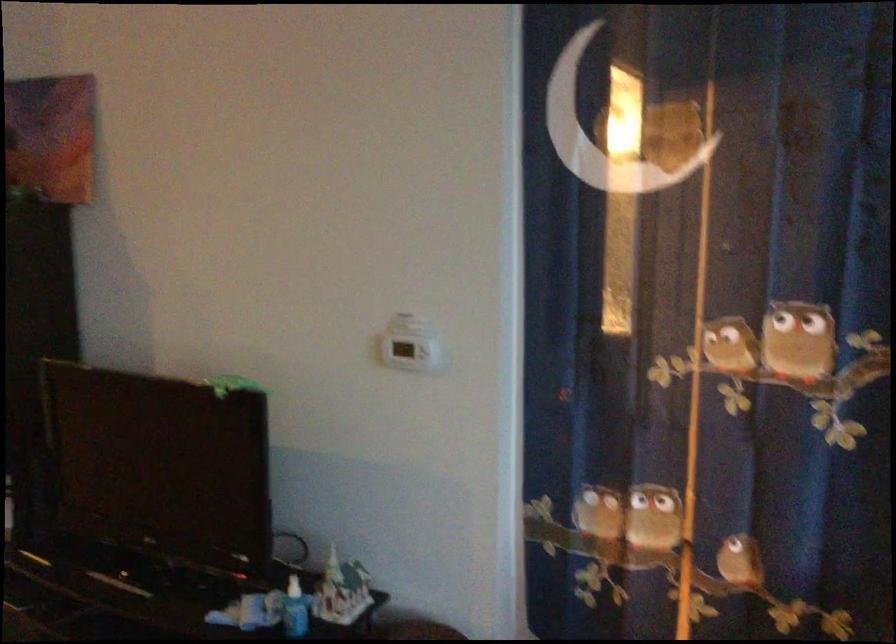
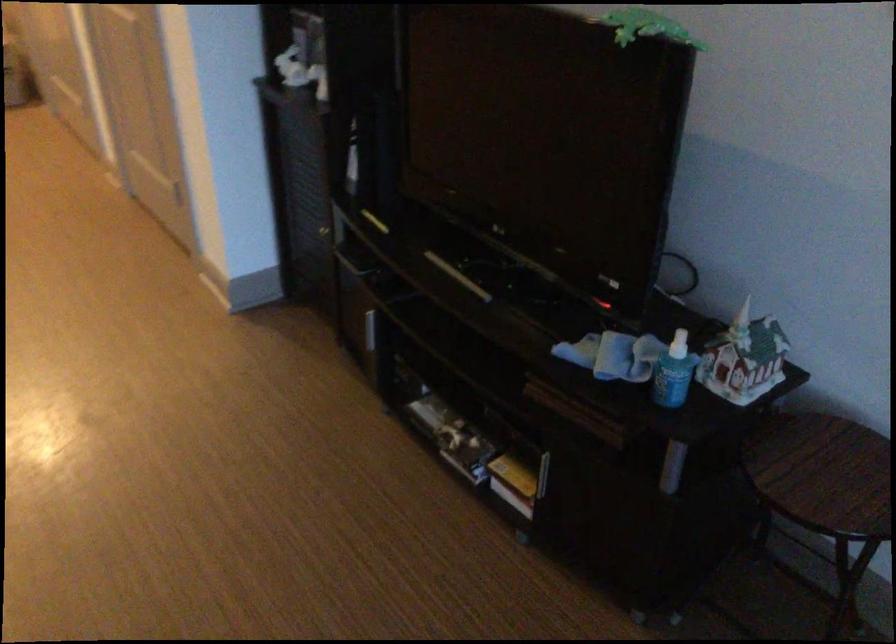
First-person continuous shooting, in which direction is the camera rotating?

The camera rotated toward left-down.